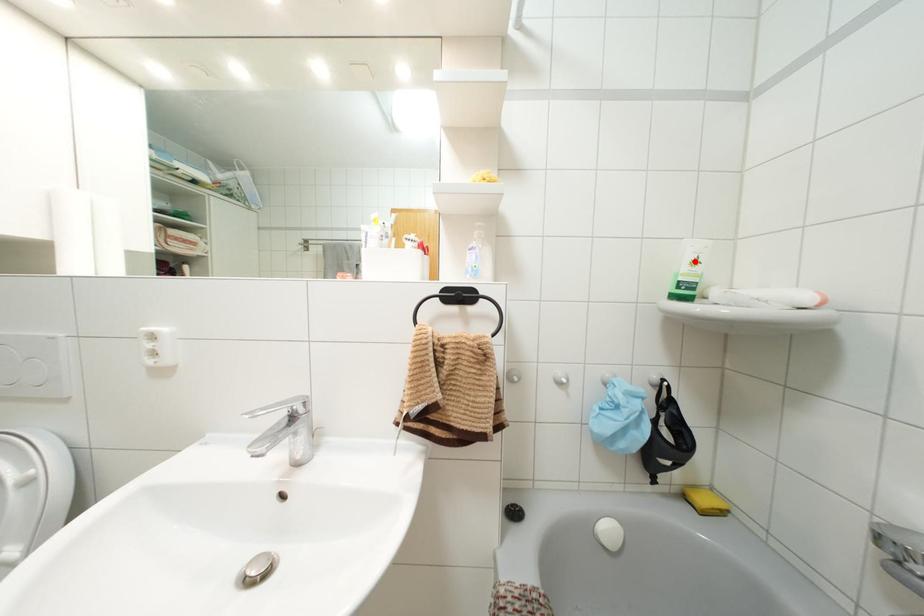
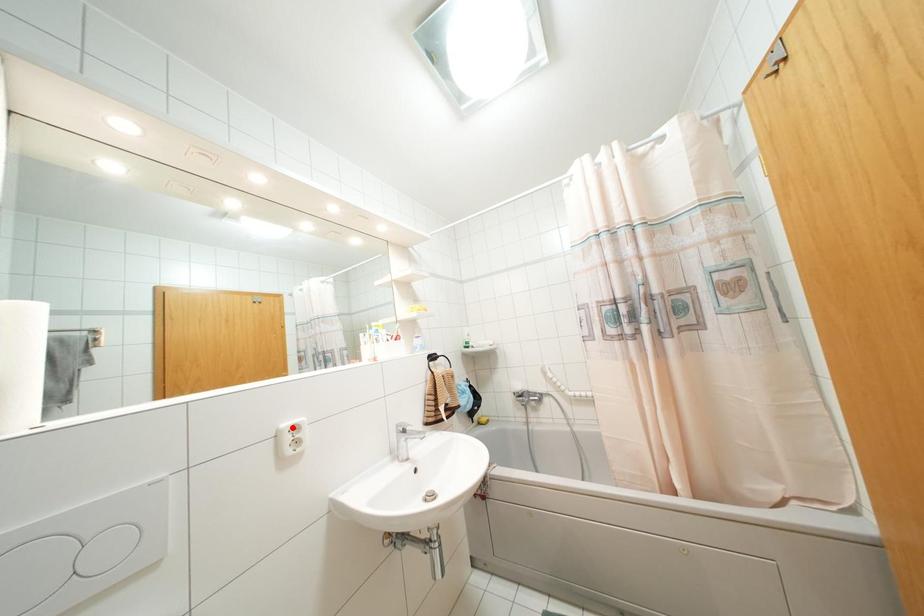
I am providing you with two images of the same scene from different viewpoints. A red point is marked on the first image and another point is marked on the second image. Are the points marked in image1 and image2 representing the same 3D position?

No